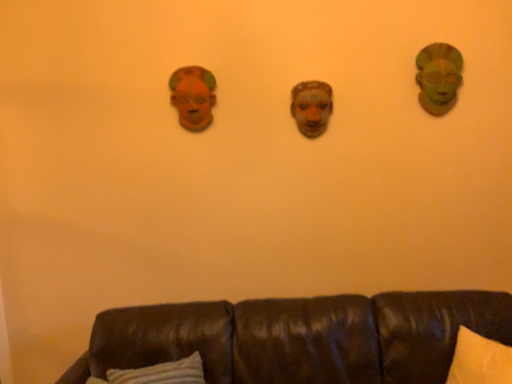
The image size is (512, 384). Identify the location of matte clay mask at center. (312, 110).

From a real-world perspective, which object stands above the other?

From a 3D spatial view, matte clay mask at center is above.

Is matte clay mask at center bigger than brown leather couch at lower center?

Actually, matte clay mask at center might be smaller than brown leather couch at lower center.

You are a GUI agent. You are given a task and a screenshot of the screen. Output one action in this format:
    pyautogui.click(x=<x>, y=<y>)
    Task: Click on the human face behind the brown leather couch at lower center
    The image size is (512, 384).
    Given the screenshot: What is the action you would take?
    pyautogui.click(x=312, y=110)

Considering the sizes of matte clay mask at center and brown leather couch at lower center in the image, is matte clay mask at center wider or thinner than brown leather couch at lower center?

In the image, matte clay mask at center appears to be more narrow than brown leather couch at lower center.

Between brown leather couch at lower center and matte orange mask at upper left, which one has larger width?

brown leather couch at lower center is wider.

Considering the positions of objects brown leather couch at lower center and matte orange mask at upper left in the image provided, who is more to the left, brown leather couch at lower center or matte orange mask at upper left?

matte orange mask at upper left is more to the left.

From a real-world perspective, does brown leather couch at lower center stand above matte orange mask at upper left?

Incorrect, from a real-world perspective, brown leather couch at lower center is lower than matte orange mask at upper left.

In the image, there is a matte orange mask at upper left. What are the coordinates of `studio couch below it (from a real-world perspective)` in the screenshot? It's located at (300, 337).

From a real-world perspective, which object stands above the other?

From a 3D spatial view, green matte mask at upper right is above.

Considering the relative positions of green matte mask at upper right and matte orange mask at upper left in the image provided, is green matte mask at upper right to the left or to the right of matte orange mask at upper left?

green matte mask at upper right is to the right of matte orange mask at upper left.

Could you tell me if green matte mask at upper right is facing matte orange mask at upper left?

No, green matte mask at upper right is not oriented towards matte orange mask at upper left.

Looking at this image, which point is more forward, (176, 105) or (294, 103)?

The point (294, 103) is closer to the camera.

Is matte orange mask at upper left shorter than matte clay mask at center?

Incorrect, the height of matte orange mask at upper left does not fall short of that of matte clay mask at center.

Is matte clay mask at center surrounded by matte orange mask at upper left?

No, matte clay mask at center is not a part of matte orange mask at upper left.

From the image's perspective, is matte orange mask at upper left under matte clay mask at center?

No, from the image's perspective, matte orange mask at upper left is not beneath matte clay mask at center.

Is matte clay mask at center placed right next to green matte mask at upper right?

matte clay mask at center is not next to green matte mask at upper right, and they're not touching.

Is matte clay mask at center oriented towards green matte mask at upper right?

No, matte clay mask at center is not oriented towards green matte mask at upper right.

Measure the distance between matte clay mask at center and green matte mask at upper right.

matte clay mask at center is 20.33 inches from green matte mask at upper right.

Between matte orange mask at upper left and brown leather couch at lower center, which one has more height?

brown leather couch at lower center.

Where is `studio couch on the right of the matte orange mask at upper left`? This screenshot has height=384, width=512. studio couch on the right of the matte orange mask at upper left is located at coordinates (300, 337).

From the image's perspective, between matte orange mask at upper left and brown leather couch at lower center, who is located below?

brown leather couch at lower center, from the image's perspective.

Considering the relative sizes of matte orange mask at upper left and brown leather couch at lower center in the image provided, is matte orange mask at upper left bigger than brown leather couch at lower center?

No.

Locate an element on the screen. The width and height of the screenshot is (512, 384). person above the brown leather couch at lower center (from the image's perspective) is located at coordinates (438, 77).

Is green matte mask at upper right spatially inside brown leather couch at lower center, or outside of it?

green matte mask at upper right is not enclosed by brown leather couch at lower center.

What's the angular difference between green matte mask at upper right and brown leather couch at lower center's facing directions?

The angle between the facing direction of green matte mask at upper right and the facing direction of brown leather couch at lower center is 1 degrees.

From the image's perspective, which object appears higher, green matte mask at upper right or brown leather couch at lower center?

green matte mask at upper right appears higher in the image.

Identify the location of human face that appears above the brown leather couch at lower center (from the image's perspective). (312, 110).

This screenshot has height=384, width=512. I want to click on studio couch located below the matte orange mask at upper left (from the image's perspective), so click(300, 337).

Estimate the real-world distances between objects in this image. Which object is closer to matte clay mask at center, green matte mask at upper right or brown leather couch at lower center?

Based on the image, green matte mask at upper right appears to be nearer to matte clay mask at center.

From the picture: Based on their spatial positions, is green matte mask at upper right or matte clay mask at center further from brown leather couch at lower center?

Among the two, green matte mask at upper right is located further to brown leather couch at lower center.

Estimate the real-world distances between objects in this image. Which object is closer to brown leather couch at lower center, matte orange mask at upper left or matte clay mask at center?

Based on the image, matte clay mask at center appears to be nearer to brown leather couch at lower center.

From the image, which object appears to be nearer to brown leather couch at lower center, matte clay mask at center or matte orange mask at upper left?

matte clay mask at center lies closer to brown leather couch at lower center than the other object.

Looking at the image, which one is located closer to matte orange mask at upper left, matte clay mask at center or brown leather couch at lower center?

matte clay mask at center lies closer to matte orange mask at upper left than the other object.

Which object lies further to the anchor point green matte mask at upper right, matte orange mask at upper left or brown leather couch at lower center?

brown leather couch at lower center is further to green matte mask at upper right.

From the image, which object appears to be farther from matte clay mask at center, green matte mask at upper right or matte orange mask at upper left?

The object further to matte clay mask at center is green matte mask at upper right.

Based on their spatial positions, is green matte mask at upper right or brown leather couch at lower center closer to matte orange mask at upper left?

Based on the image, green matte mask at upper right appears to be nearer to matte orange mask at upper left.

The width and height of the screenshot is (512, 384). I want to click on decor between green matte mask at upper right and brown leather couch at lower center in the vertical direction, so click(193, 96).

You are a GUI agent. You are given a task and a screenshot of the screen. Output one action in this format:
    pyautogui.click(x=<x>, y=<y>)
    Task: Click on the human face between matte orange mask at upper left and brown leather couch at lower center in the up-down direction
    Image resolution: width=512 pixels, height=384 pixels.
    Given the screenshot: What is the action you would take?
    pyautogui.click(x=312, y=110)

You are a GUI agent. You are given a task and a screenshot of the screen. Output one action in this format:
    pyautogui.click(x=<x>, y=<y>)
    Task: Click on the human face between matte orange mask at upper left and green matte mask at upper right from left to right
    
    Given the screenshot: What is the action you would take?
    pyautogui.click(x=312, y=110)

Identify the location of human face between green matte mask at upper right and brown leather couch at lower center vertically. (312, 110).